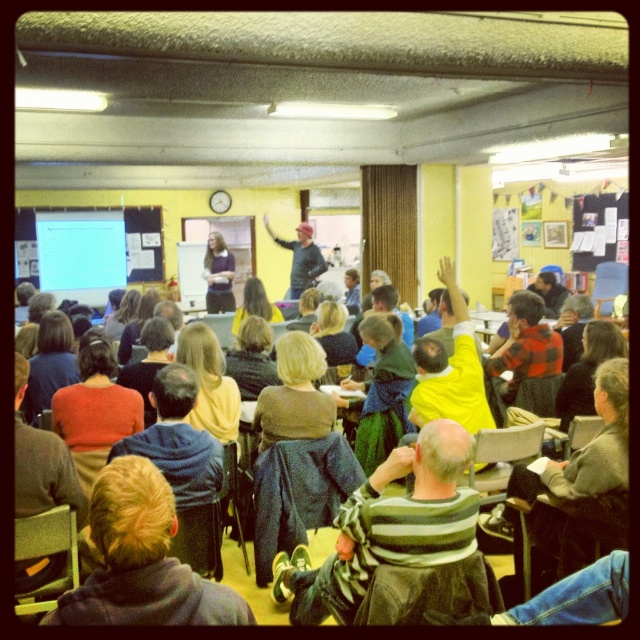
This screenshot has height=640, width=640. Describe the element at coordinates (218, 275) in the screenshot. I see `matte black shirt at center` at that location.

Is point (211, 269) farther from viewer compared to point (300, 252)?

Yes, point (211, 269) is behind point (300, 252).

Measure the distance between matte black shirt at center and camera.

matte black shirt at center and camera are 9.30 meters apart.

Where is `matte black shirt at center`? This screenshot has width=640, height=640. matte black shirt at center is located at coordinates (218, 275).

Can you confirm if striped sweater at center is wider than matte black shirt at center?

Indeed, striped sweater at center has a greater width compared to matte black shirt at center.

Based on the photo, who is positioned more to the left, striped sweater at center or matte black shirt at center?

matte black shirt at center is more to the left.

Is point (301, 618) positioned behind point (220, 284)?

No, it is not.

The height and width of the screenshot is (640, 640). What are the coordinates of `striped sweater at center` in the screenshot? It's located at (388, 525).

Can you confirm if striped sweater at center is thinner than dark blue sweater at center?

No.

Is point (355, 497) less distant than point (305, 250)?

Yes, it is in front of point (305, 250).

At what (x,y) coordinates should I click in order to perform the action: click on striped sweater at center. Please return your answer as a coordinate pair (x, y). The image size is (640, 640). Looking at the image, I should click on (388, 525).